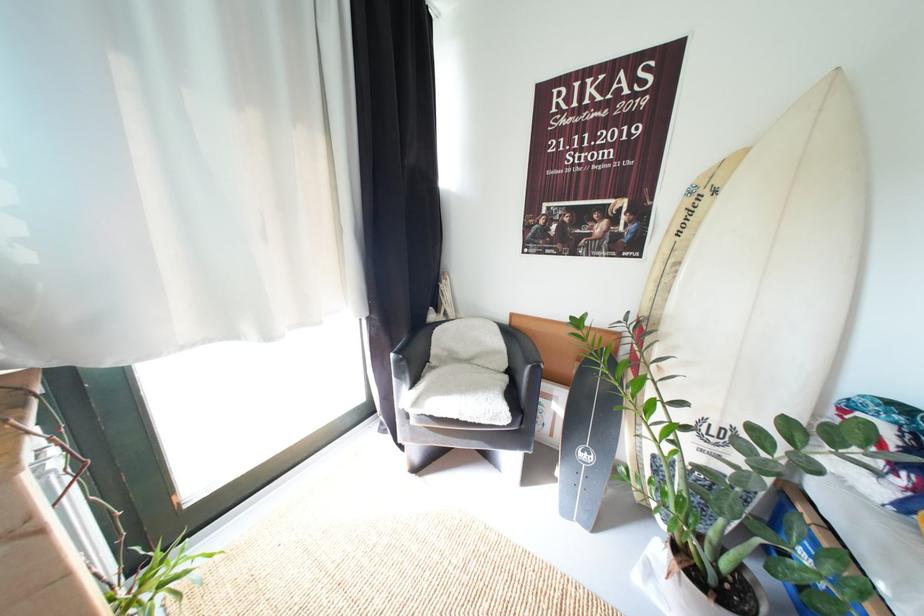
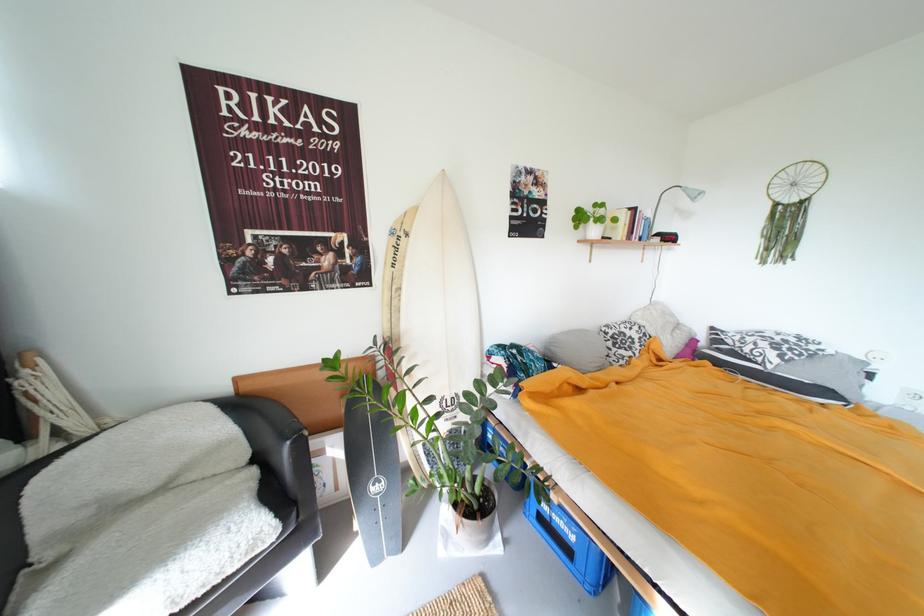
Where in the second image is the point corresponding to point 517,416 from the first image?

(284, 524)